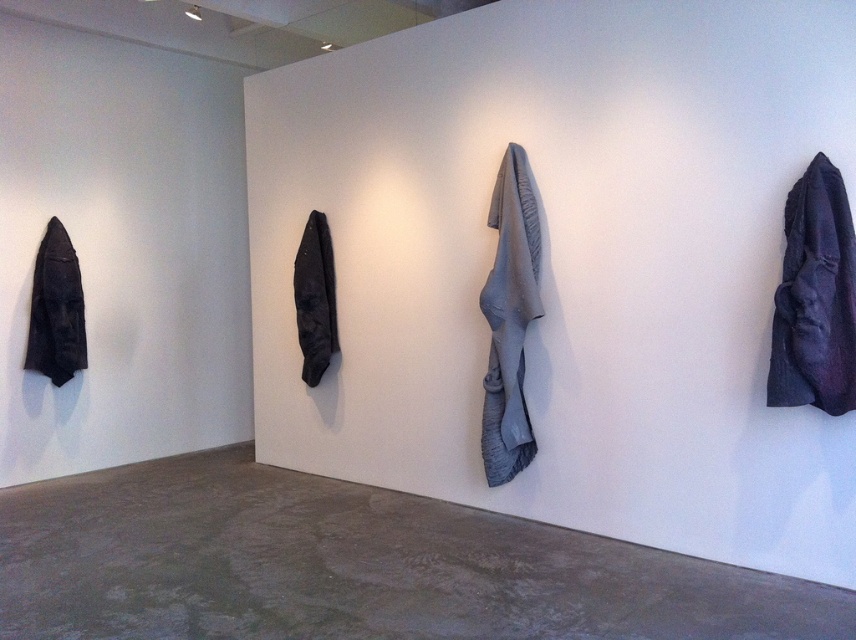
Which of these two, dark matte fabric at right or matte black jacket at center, stands taller?

With more height is matte black jacket at center.

Find the location of a particular element. The image size is (856, 640). dark matte fabric at right is located at coordinates pyautogui.click(x=815, y=298).

This screenshot has height=640, width=856. Find the location of `dark matte fabric at right`. dark matte fabric at right is located at coordinates (815, 298).

Who is higher up, matte black jacket at left or matte black jacket at center?

matte black jacket at center

Based on the photo, between matte black jacket at left and matte black jacket at center, which one appears on the right side from the viewer's perspective?

From the viewer's perspective, matte black jacket at center appears more on the right side.

Where is `matte black jacket at left`? This screenshot has height=640, width=856. matte black jacket at left is located at coordinates (56, 308).

Where is `matte black jacket at left`? matte black jacket at left is located at coordinates (56, 308).

Can you confirm if gray fabric at center is smaller than matte black jacket at left?

No.

How distant is gray fabric at center from matte black jacket at left?

They are 3.36 meters apart.

Who is more forward, (x=528, y=284) or (x=73, y=305)?

Point (x=528, y=284)

Where is `gray fabric at center`? gray fabric at center is located at coordinates (509, 317).